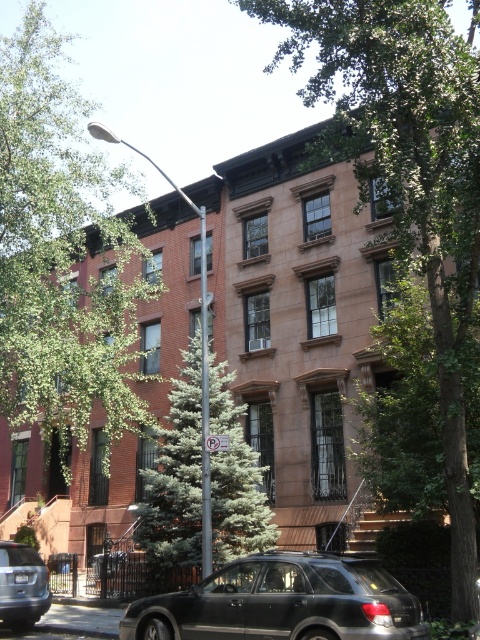
You are a window installer assessing the space between the green leafy tree at upper center and the green textured evergreen tree at center for a new air conditioning unit. Which tree is closer to the window where the unit will be installed?

The green textured evergreen tree at center is closer to the window because the green leafy tree at upper center is bigger, implying it is farther away.

You are standing in front of the row of brick townhouses and want to take a photo of the green leafy tree at upper center. If your camera can focus on objects up to 10 meters away, will you be able to capture a clear photo of the tree?

The green leafy tree at upper center is 8.87 meters away from the camera, which is within the camera focus range of up to 10 meters. Therefore, you can capture a clear photo of the tree.

You are standing in front of the row of brick townhouses and notice two trees. The first is the green leafy tree at upper center, and the second is the green textured evergreen tree at center. Which tree is positioned to the right of the other?

The green leafy tree at upper center is positioned to the right of the green textured evergreen tree at center.